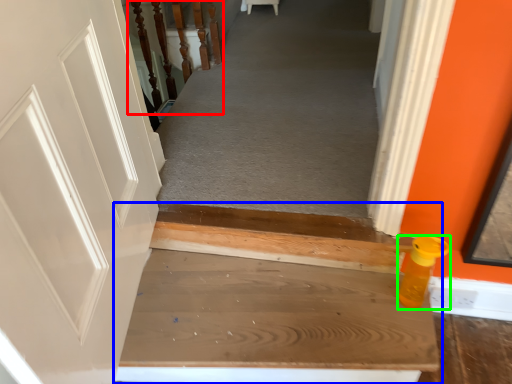
Question: Based on their relative distances, which object is nearer to rail (highlighted by a red box)? Choose from stairs (highlighted by a blue box) and bottle (highlighted by a green box).

Choices:
 (A) stairs
 (B) bottle

Answer: (A)